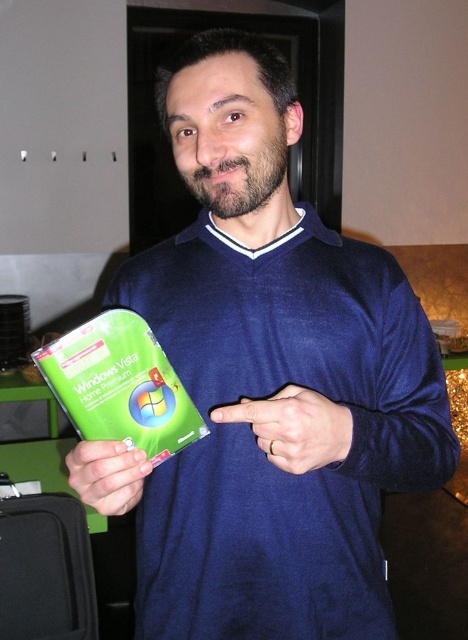
Does green plastic windows vista home premium at center appear on the right side of matte green plastic at lower left?

Yes, green plastic windows vista home premium at center is to the right of matte green plastic at lower left.

Between green plastic windows vista home premium at center and matte green plastic at lower left, which one is positioned higher?

green plastic windows vista home premium at center

Is point (103, 339) behind point (121, 504)?

Yes, point (103, 339) is behind point (121, 504).

Identify the location of green plastic windows vista home premium at center. (119, 385).

Can you confirm if green plastic windows vista home premium at center is smaller than matte blue hand at center?

Incorrect, green plastic windows vista home premium at center is not smaller in size than matte blue hand at center.

Between green plastic windows vista home premium at center and matte blue hand at center, which one has more height?

green plastic windows vista home premium at center

From the picture: Who is more forward, (77,419) or (299,474)?

Point (299,474)

Identify the location of green plastic windows vista home premium at center. The width and height of the screenshot is (468, 640). (119, 385).

Is point (255, 440) in front of point (87, 461)?

That is False.

Can you confirm if matte blue hand at center is positioned above matte green plastic at lower left?

Correct, matte blue hand at center is located above matte green plastic at lower left.

This screenshot has height=640, width=468. Identify the location of matte blue hand at center. (293, 428).

At what (x,y) coordinates should I click in order to perform the action: click on matte blue hand at center. Please return your answer as a coordinate pair (x, y). This screenshot has width=468, height=640. Looking at the image, I should click on click(293, 428).